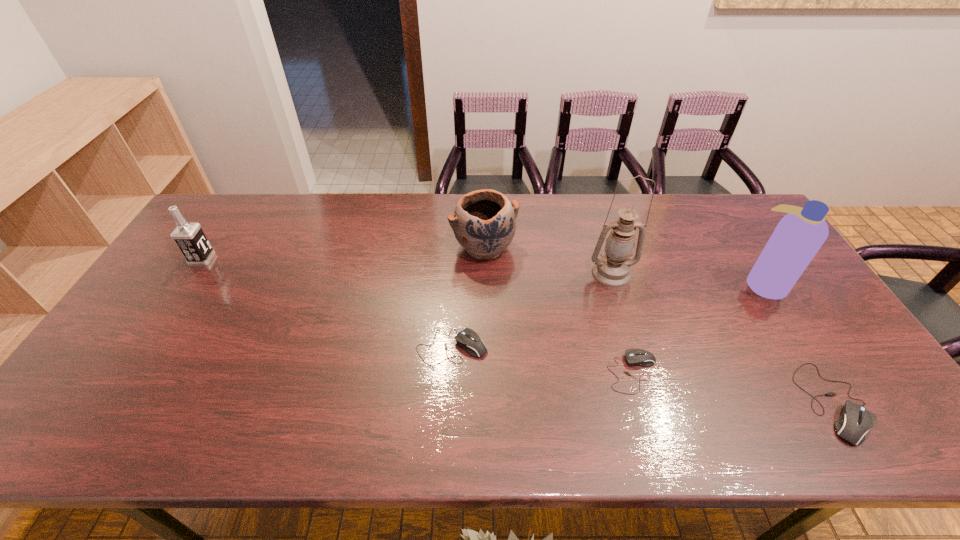
Image resolution: width=960 pixels, height=540 pixels. In order to click on vacant area between the second tallest computer mouse and the rightmost computer mouse in this screenshot , I will do `click(643, 374)`.

You are a GUI agent. You are given a task and a screenshot of the screen. Output one action in this format:
    pyautogui.click(x=<x>, y=<y>)
    Task: Click on the blank region between the sixth tallest object and the pottery
    
    Given the screenshot: What is the action you would take?
    pyautogui.click(x=468, y=297)

This screenshot has width=960, height=540. I want to click on vacant area that lies between the vodka and the pottery, so click(343, 253).

I want to click on object that is the sixth closest one to the shortest object, so click(x=189, y=237).

Where is `object that is the fourth nearest to the pottery`? The height and width of the screenshot is (540, 960). object that is the fourth nearest to the pottery is located at coordinates (799, 235).

Locate an element on the screen. This screenshot has height=540, width=960. computer mouse that is the nearest to the sixth tallest object is located at coordinates (635, 357).

Image resolution: width=960 pixels, height=540 pixels. What are the coordinates of `the second closest computer mouse to the oil lamp` in the screenshot? It's located at (468, 339).

Where is `free space that satisfies the following two spatial constraints: 1. on the front label of the oil lamp; 2. on the right side of the vodka`? free space that satisfies the following two spatial constraints: 1. on the front label of the oil lamp; 2. on the right side of the vodka is located at coordinates (193, 274).

This screenshot has width=960, height=540. Identify the location of blank area in the image that satisfies the following two spatial constraints: 1. on the back side of the shortest object; 2. on the left side of the oil lamp. (605, 274).

Locate an element on the screen. free space that satisfies the following two spatial constraints: 1. on the front label of the vodka; 2. on the right side of the leftmost computer mouse is located at coordinates (145, 347).